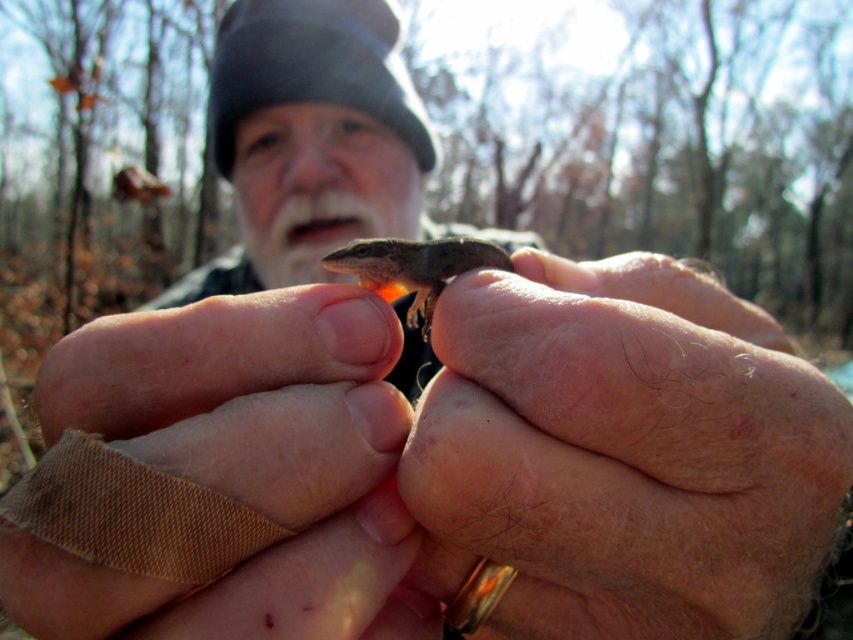
Does leather-like brown glove at center have a lesser height compared to smooth brown lizard at center?

No.

Is the position of leather-like brown glove at center less distant than that of smooth brown lizard at center?

Yes, leather-like brown glove at center is closer to the viewer.

What are the coordinates of `leather-like brown glove at center` in the screenshot? It's located at (241, 467).

Is point (749, 396) closer to viewer compared to point (140, 394)?

Yes, point (749, 396) is closer to viewer.

Image resolution: width=853 pixels, height=640 pixels. I want to click on smooth skin hand at center, so click(x=624, y=454).

Can you confirm if smooth skin hand at center is thinner than smooth brown lizard at center?

Incorrect, smooth skin hand at center's width is not less than smooth brown lizard at center's.

The image size is (853, 640). Identify the location of smooth skin hand at center. pyautogui.click(x=624, y=454).